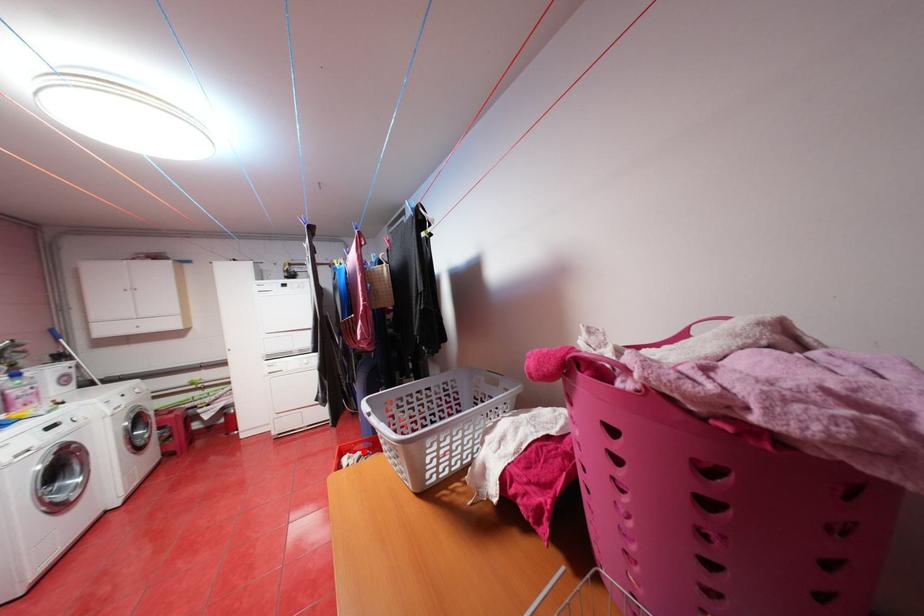
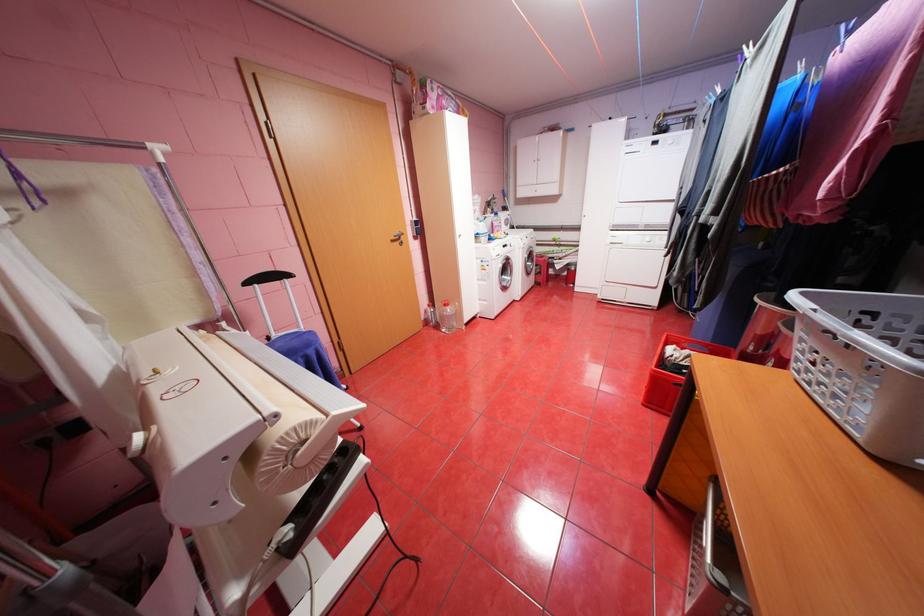
Question: I am providing you with two images of the same scene from different viewpoints. A red point is marked on the first image. Can you still see the location of the red point in image 2?

Choices:
 (A) Yes
 (B) No

Answer: (A)